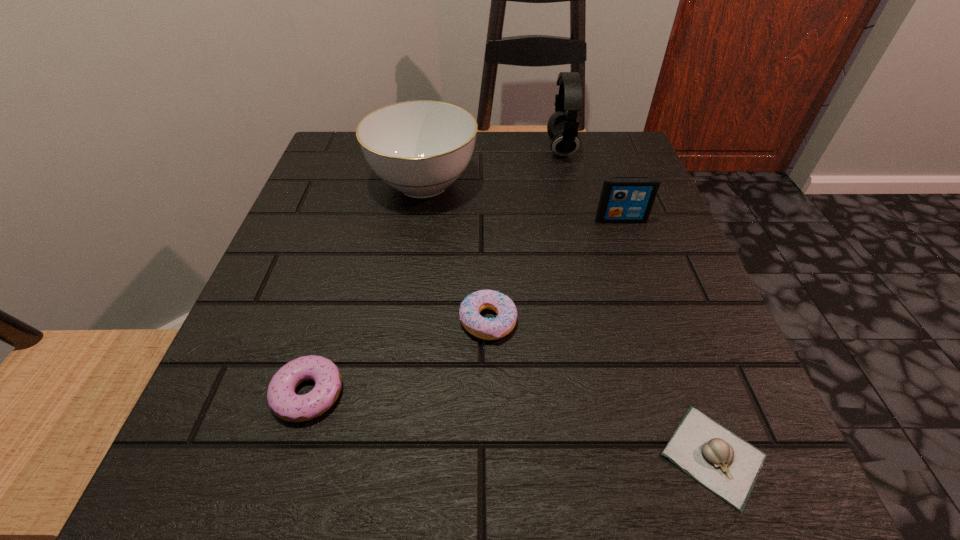
In the image, there is a desktop. What are the coordinates of `vacant space at the near left corner` in the screenshot? It's located at (180, 463).

The image size is (960, 540). I want to click on vacant space at the far right corner of the desktop, so click(601, 165).

Identify the location of free area in between the garlic and the tallest object. This screenshot has height=540, width=960. (637, 302).

You are a GUI agent. You are given a task and a screenshot of the screen. Output one action in this format:
    pyautogui.click(x=<x>, y=<y>)
    Task: Click on the free space between the garlic and the nearer doughnut
    The height and width of the screenshot is (540, 960).
    Given the screenshot: What is the action you would take?
    pyautogui.click(x=511, y=424)

Where is `vacant area that lies between the garlic and the tallest object`? vacant area that lies between the garlic and the tallest object is located at coordinates (637, 302).

Find the location of a particular element. The height and width of the screenshot is (540, 960). free space between the fourth shortest object and the earphone is located at coordinates (591, 184).

Find the location of a particular element. unoccupied area between the nearer doughnut and the fourth farthest object is located at coordinates (398, 357).

Find the location of a particular element. The image size is (960, 540). vacant area that lies between the garlic and the earphone is located at coordinates (637, 302).

Identify the location of free spot between the chinaware and the fourth farthest object. Image resolution: width=960 pixels, height=540 pixels. (456, 252).

I want to click on free space between the chinaware and the garlic, so click(568, 319).